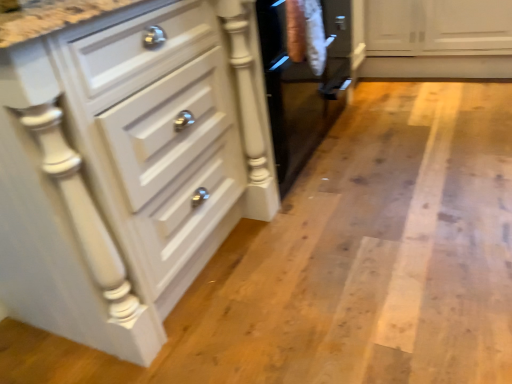
What do you see at coordinates (126, 167) in the screenshot? I see `white glossy cabinet at center` at bounding box center [126, 167].

This screenshot has width=512, height=384. I want to click on white glossy cabinet at center, so click(x=126, y=167).

This screenshot has height=384, width=512. What are the coordinates of `white glossy cabinet at center` in the screenshot? It's located at (126, 167).